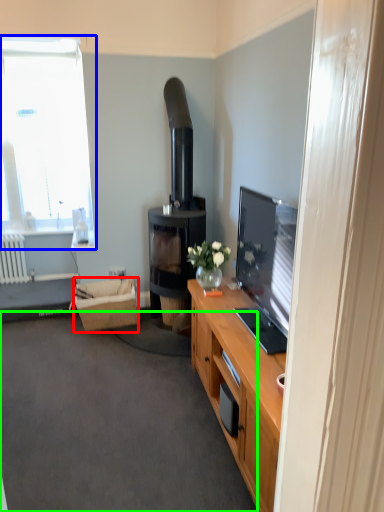
Question: Which object is the farthest from picnic basket (highlighted by a red box)? Choose among these: window (highlighted by a blue box) or plain (highlighted by a green box).

Choices:
 (A) window
 (B) plain

Answer: (A)